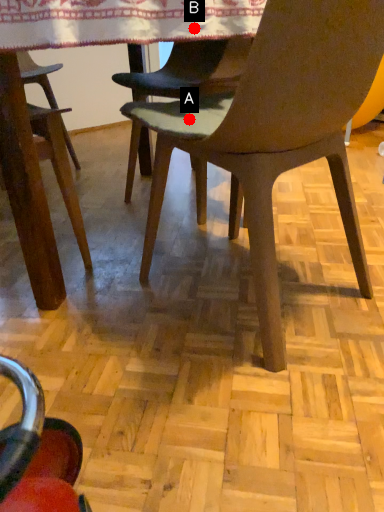
Question: Two points are circled on the image, labeled by A and B beside each circle. Which of the following is the closest to the observer?

Choices:
 (A) A is closer
 (B) B is closer

Answer: (B)